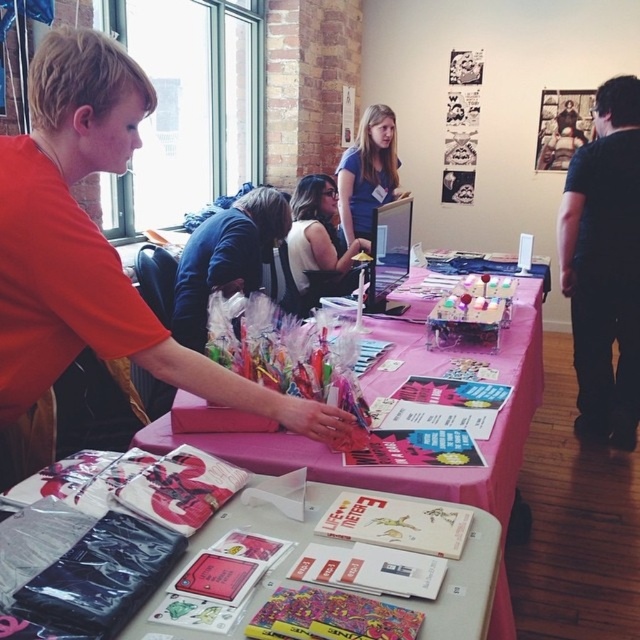
Does pink fabric tablecloth at center come behind white fabric shirt at center?

No, it is not.

Can you confirm if pink fabric tablecloth at center is shorter than white fabric shirt at center?

Incorrect, pink fabric tablecloth at center's height does not fall short of white fabric shirt at center's.

Who is more forward, (x=456, y=486) or (x=292, y=264)?

Point (x=456, y=486) is more forward.

At what (x,y) coordinates should I click in order to perform the action: click on pink fabric tablecloth at center. Please return your answer as a coordinate pair (x, y). The image size is (640, 640). Looking at the image, I should click on (388, 394).

This screenshot has height=640, width=640. Describe the element at coordinates (90, 260) in the screenshot. I see `matte orange shirt at left` at that location.

Looking at this image, can you confirm if matte orange shirt at left is thinner than white paper goods at center?

Correct, matte orange shirt at left's width is less than white paper goods at center's.

Who is more distant from viewer, (97, 349) or (195, 451)?

The point (195, 451) is behind.

This screenshot has width=640, height=640. I want to click on matte orange shirt at left, so click(x=90, y=260).

Who is lower down, black cotton shirt at right or white paper goods at center?

white paper goods at center

Does black cotton shirt at right have a lesser width compared to white paper goods at center?

Answer: Yes.

The image size is (640, 640). Describe the element at coordinates (604, 266) in the screenshot. I see `black cotton shirt at right` at that location.

Locate an element on the screen. The image size is (640, 640). black cotton shirt at right is located at coordinates (604, 266).